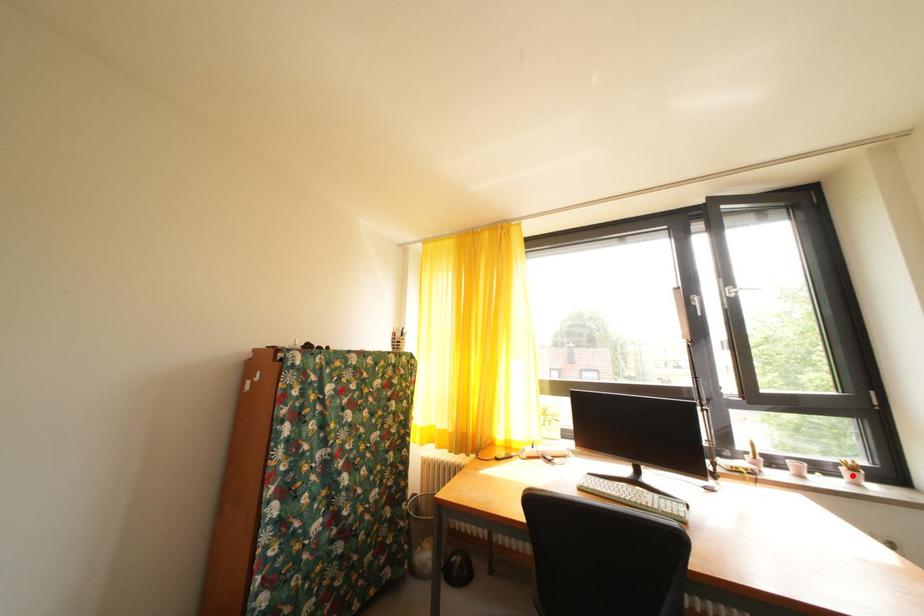
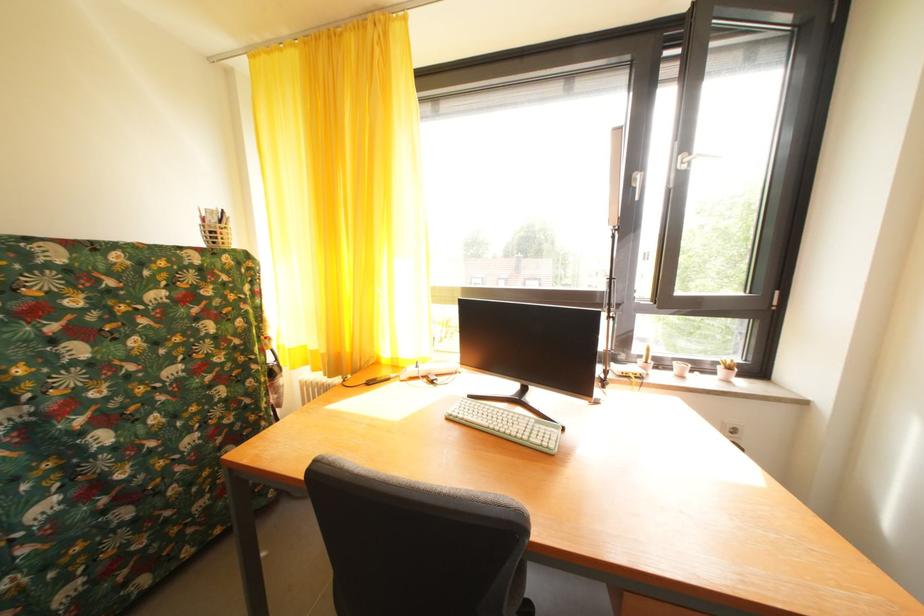
Locate, in the second image, the point that corresponds to the highlighted location in the first image.

(728, 374)